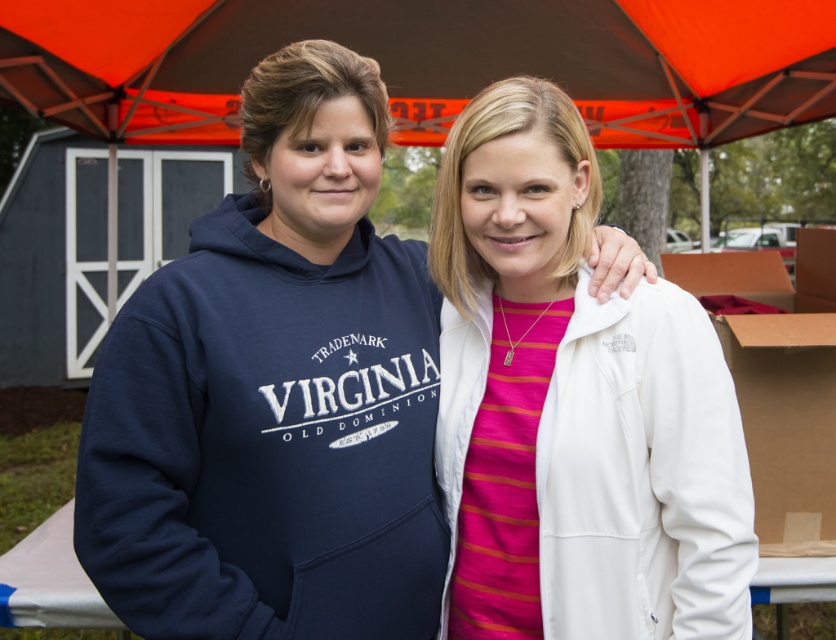
Question: Does orange fabric canopy at upper center lie in front of white fleece sweatshirt at center?

Choices:
 (A) no
 (B) yes

Answer: (A)

Question: Is navy blue hoodie at left below navy fleece sweatshirt at center?

Choices:
 (A) no
 (B) yes

Answer: (A)

Question: Does orange fabric canopy at upper center appear on the right side of white fleece sweatshirt at center?

Choices:
 (A) no
 (B) yes

Answer: (A)

Question: Among these points, which one is farthest from the camera?

Choices:
 (A) (232, 232)
 (B) (794, 45)

Answer: (B)

Question: Which object is closer to the camera taking this photo?

Choices:
 (A) navy blue hoodie at left
 (B) orange fabric canopy at upper center
 (C) white fleece sweatshirt at center

Answer: (A)

Question: Which point appears farthest from the camera in this image?

Choices:
 (A) (357, 262)
 (B) (133, 333)
 (C) (480, 337)
 (D) (727, 60)

Answer: (D)